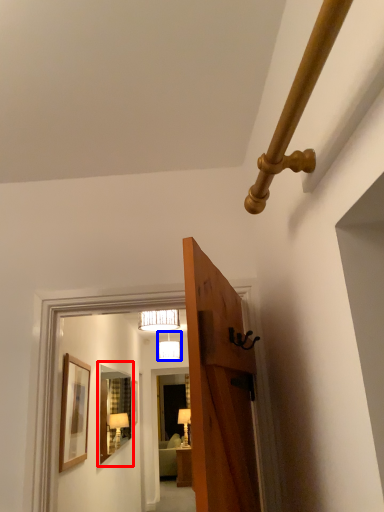
Question: Which point is closer to the camera, mirror (highlighted by a red box) or lamp (highlighted by a blue box)?

Choices:
 (A) mirror
 (B) lamp

Answer: (A)